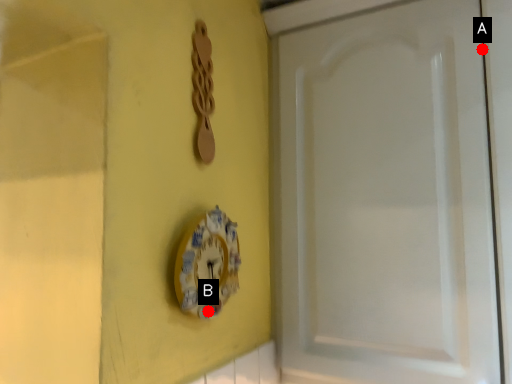
Question: Two points are circled on the image, labeled by A and B beside each circle. Which point is closer to the camera taking this photo?

Choices:
 (A) A is closer
 (B) B is closer

Answer: (B)